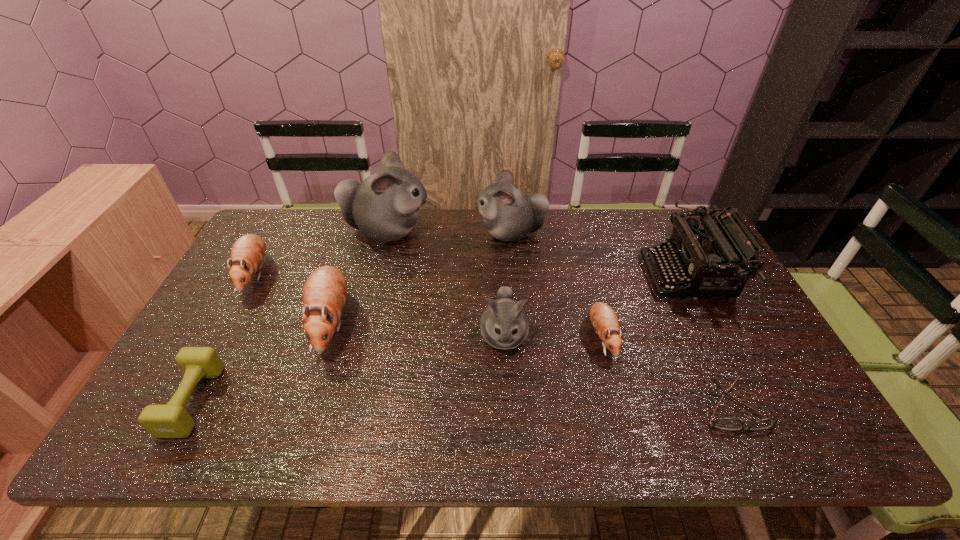
You are a GUI agent. You are given a task and a screenshot of the screen. Output one action in this format:
    pyautogui.click(x=<x>, y=<y>)
    Task: Click on the vacant region that satisfies the following two spatial constraints: 1. on the face of the biggest white hamster; 2. at the face of the second brown hamster from left to right
    Image resolution: width=960 pixels, height=540 pixels.
    Given the screenshot: What is the action you would take?
    pyautogui.click(x=364, y=322)